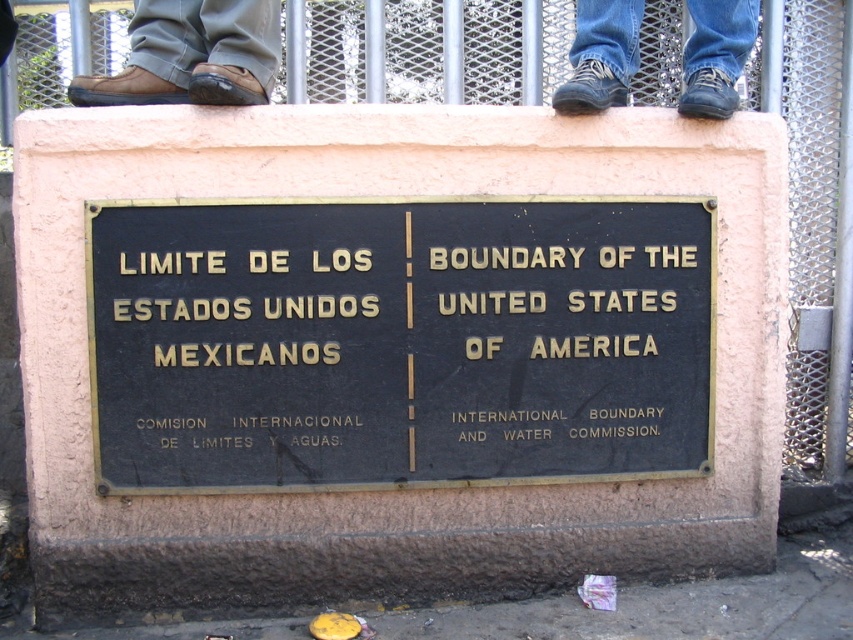
You are standing in front of the plaque and want to place a small object between the brown leather shoes at upper left and the blue jeans at upper center. Which object is closer to you, and will the space between them be sufficient for placing the object?

The brown leather shoes at upper left is closer to the viewer than the blue jeans at upper center. The space between them is sufficient for placing the object as they are positioned at different distances from the viewer.